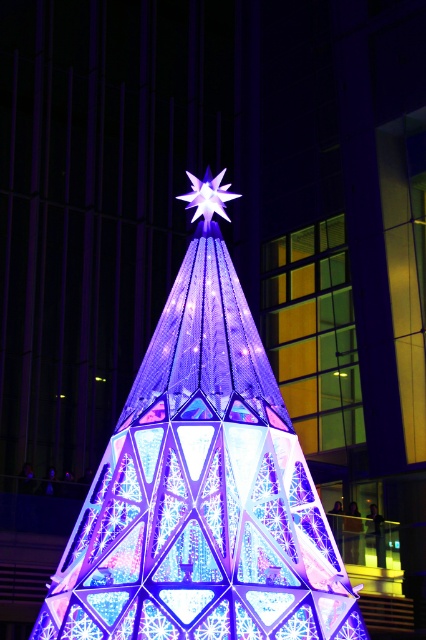
You are standing in front of the modern Christmas tree and notice two objects labeled iridescent glass christmas tree at center and iridescent glass star at center. Which object is positioned to the right of the other?

The iridescent glass christmas tree at center is to the right of the iridescent glass star at center according to the description.

You are a delivery person trying to place a large package under the iridescent glass christmas tree at center. However, there is an iridescent glass star at center in the way. Can you move the star to make space for the package?

The iridescent glass christmas tree at center might be wider than the iridescent glass star at center, so moving the star could create enough space for the package.

You are standing in front of a modern Christmas tree display. You want to take a photo of the iridescent glass christmas tree at center with your smartphone. Considering the distance, will you be able to capture the entire tree in one shot without zooming in?

The iridescent glass christmas tree at center is 59.89 meters away from camera. Since smartphones typically have a wide angle lens, capturing the entire tree at this distance without zooming in should be possible as the distance is sufficient for the camera to fit the subject within the frame.